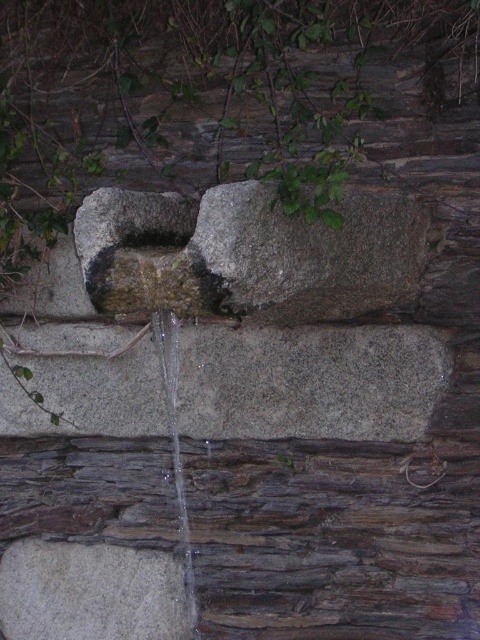
You are standing in front of the fountain and want to touch the gray rough stone at lower left. Can you reach it without moving your feet?

The gray rough stone at lower left is 3.49 meters away from viewer, so you cannot reach it without moving your feet.

You are standing in front of a rustic water fountain with a stone wall. You notice a specific point marked at coordinates (310, 381). According to the image, what color is the stone located at this point?

The point at (310, 381) marks gray stone at center.